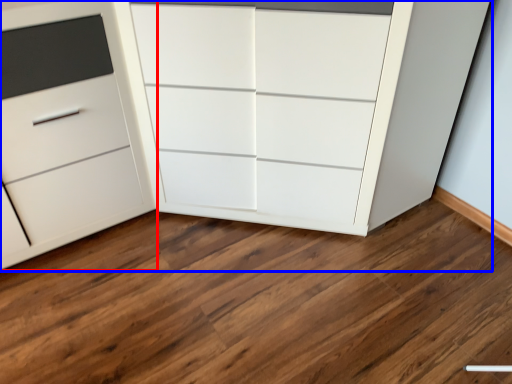
Question: Which object appears farthest to the camera in this image, chest of drawers (highlighted by a red box) or chest of drawers (highlighted by a blue box)?

Choices:
 (A) chest of drawers
 (B) chest of drawers

Answer: (A)